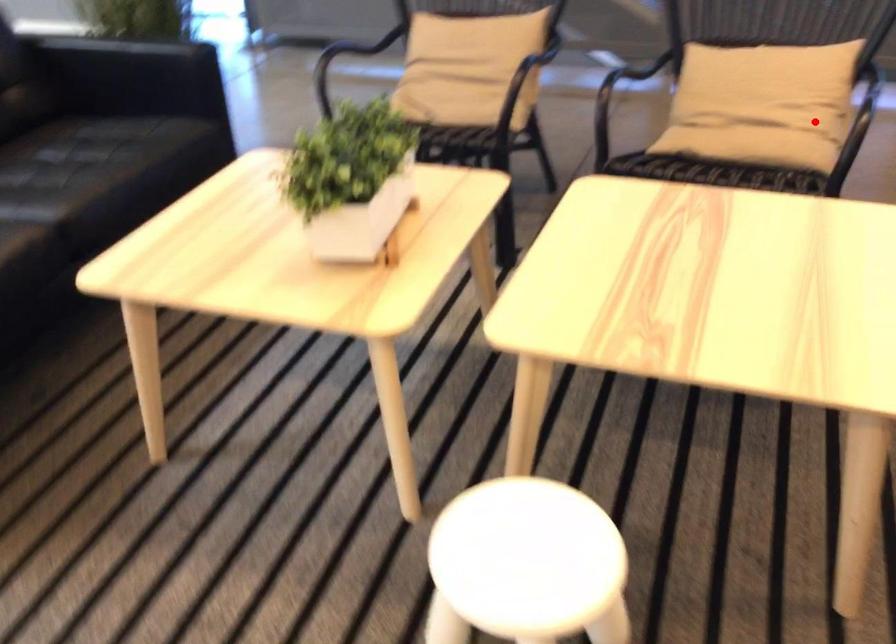
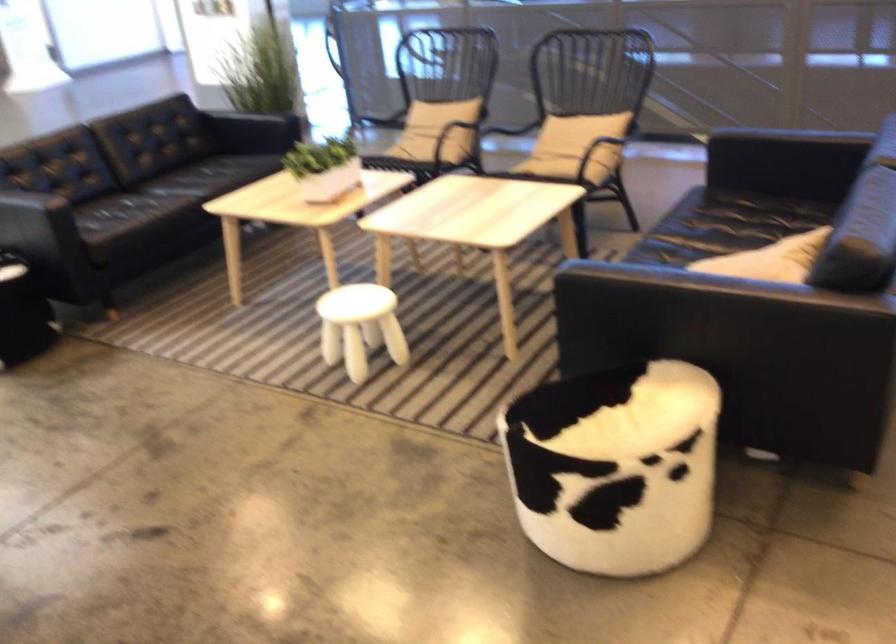
In the second image, find the point that corresponds to the highlighted location in the first image.

(574, 147)